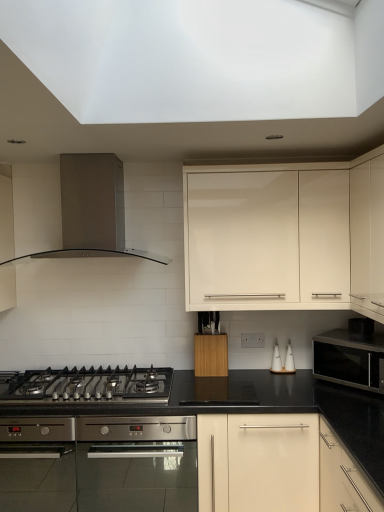
Question: Is the depth of white glossy cabinet at upper center, placed as the 2th cabinetry when sorted from right to left, less than that of stainless steel oven at center?

Choices:
 (A) no
 (B) yes

Answer: (A)

Question: Can you confirm if white glossy cabinet at upper center, placed as the 2th cabinetry when sorted from right to left, is wider than stainless steel oven at center?

Choices:
 (A) no
 (B) yes

Answer: (A)

Question: Is stainless steel oven at center at the back of white glossy cabinet at upper center, the second cabinetry viewed from the left?

Choices:
 (A) no
 (B) yes

Answer: (A)

Question: Is white glossy cabinet at upper center, placed as the 2th cabinetry when sorted from right to left, smaller than stainless steel oven at center?

Choices:
 (A) no
 (B) yes

Answer: (A)

Question: Considering the relative positions of white glossy cabinet at upper center, placed as the 2th cabinetry when sorted from right to left, and stainless steel oven at center in the image provided, is white glossy cabinet at upper center, placed as the 2th cabinetry when sorted from right to left, to the right of stainless steel oven at center from the viewer's perspective?

Choices:
 (A) no
 (B) yes

Answer: (B)

Question: Is stainless steel oven at center completely or partially inside white glossy cabinet at upper center, the second cabinetry viewed from the left?

Choices:
 (A) no
 (B) yes

Answer: (A)

Question: Considering the relative sizes of white glossy cabinet at upper center, placed as the 2th cabinetry when sorted from right to left, and white ceramic salt shaker at center-right, the 2th appliance when ordered from right to left, in the image provided, is white glossy cabinet at upper center, placed as the 2th cabinetry when sorted from right to left, bigger than white ceramic salt shaker at center-right, the 2th appliance when ordered from right to left,?

Choices:
 (A) yes
 (B) no

Answer: (A)

Question: Considering the relative sizes of white glossy cabinet at upper center, the second cabinetry viewed from the left, and white ceramic salt shaker at center-right, the 2th appliance when ordered from right to left, in the image provided, is white glossy cabinet at upper center, the second cabinetry viewed from the left, smaller than white ceramic salt shaker at center-right, the 2th appliance when ordered from right to left,?

Choices:
 (A) no
 (B) yes

Answer: (A)

Question: Is white glossy cabinet at upper center, placed as the 2th cabinetry when sorted from right to left, far from white ceramic salt shaker at center-right, the first appliance when ordered from left to right?

Choices:
 (A) no
 (B) yes

Answer: (A)

Question: Does white glossy cabinet at upper center, placed as the 2th cabinetry when sorted from right to left, come in front of white ceramic salt shaker at center-right, the 2th appliance when ordered from right to left?

Choices:
 (A) no
 (B) yes

Answer: (B)

Question: Does white glossy cabinet at upper center, the second cabinetry viewed from the left, contain white ceramic salt shaker at center-right, the 2th appliance when ordered from right to left?

Choices:
 (A) no
 (B) yes

Answer: (A)

Question: Is white glossy cabinet at upper center, placed as the 2th cabinetry when sorted from right to left, positioned with its back to white ceramic salt shaker at center-right, the first appliance when ordered from left to right?

Choices:
 (A) yes
 (B) no

Answer: (B)

Question: Is white ceramic salt and pepper shakers at center-right, the 1th appliance in the right-to-left sequence, located outside black stainless steel gas stove at lower left?

Choices:
 (A) no
 (B) yes

Answer: (B)